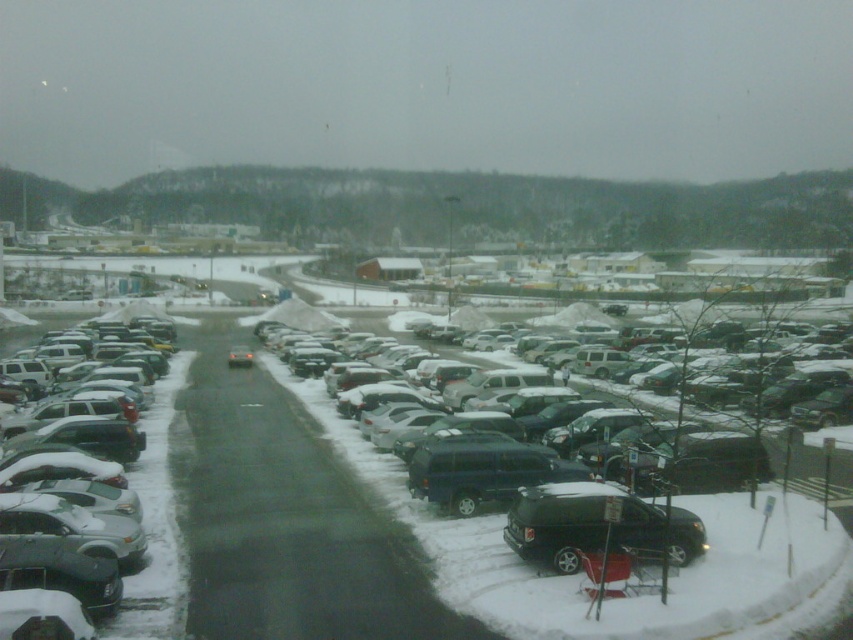
Question: Among these points, which one is farthest from the camera?

Choices:
 (A) (299, 600)
 (B) (155, 561)

Answer: (B)

Question: Which point is farther to the camera?

Choices:
 (A) sleek silver sedan at left
 (B) snow-covered cars at center

Answer: (A)

Question: Does snow-covered cars at center have a larger size compared to sleek silver sedan at left?

Choices:
 (A) yes
 (B) no

Answer: (A)

Question: Where is snow-covered cars at center located in relation to sleek silver sedan at left in the image?

Choices:
 (A) left
 (B) right

Answer: (B)

Question: Does snow-covered cars at center come behind sleek silver sedan at left?

Choices:
 (A) yes
 (B) no

Answer: (B)